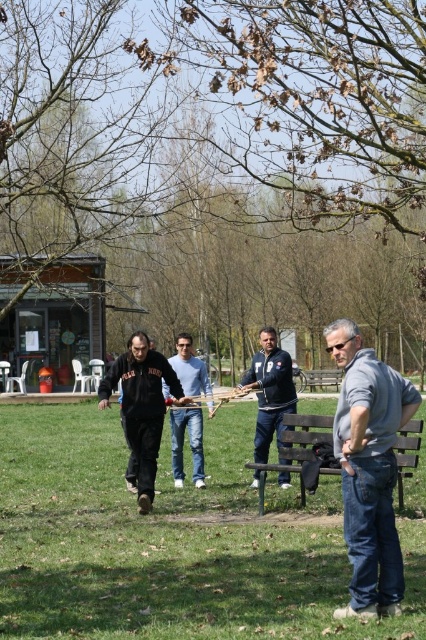
Question: Can you confirm if black fleece at center is thinner than wooden bench at center?

Choices:
 (A) no
 (B) yes

Answer: (B)

Question: Can you confirm if brown wooden bench at center is positioned below denim jeans at center?

Choices:
 (A) no
 (B) yes

Answer: (A)

Question: Which object appears farthest from the camera in this image?

Choices:
 (A) wooden bench at center
 (B) black fleece at center
 (C) gray cotton shirt at right
 (D) brown wooden bench at center

Answer: (A)

Question: Which of the following is the farthest from the observer?

Choices:
 (A) (340, 358)
 (B) (175, 342)

Answer: (B)

Question: Which of these objects is positioned farthest from the black fleece at center?

Choices:
 (A) brown wooden bench at center
 (B) gray cotton shirt at right

Answer: (B)

Question: Does black fleece at center appear on the left side of blue denim jacket at center?

Choices:
 (A) no
 (B) yes

Answer: (B)